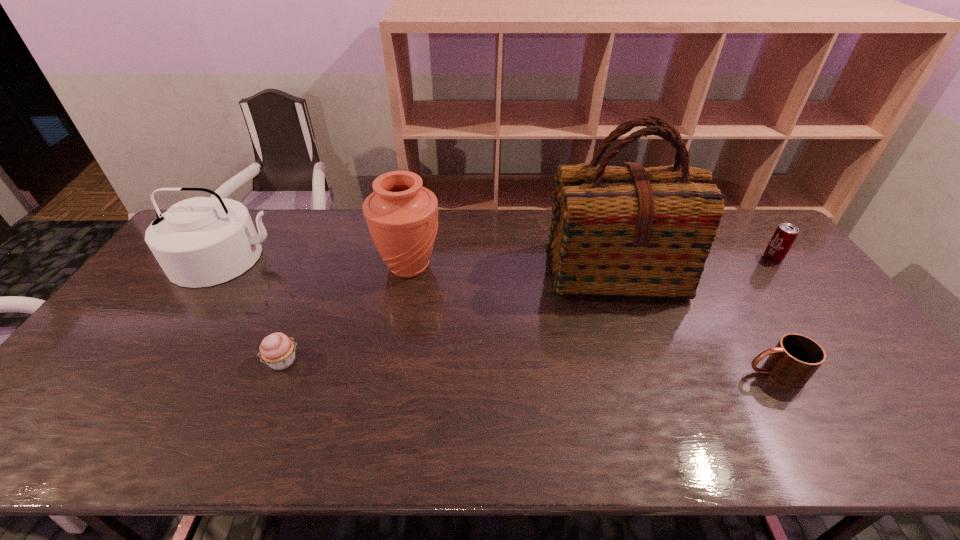
Image resolution: width=960 pixels, height=540 pixels. In order to click on object that is at the left edge in this screenshot , I will do `click(199, 242)`.

You are a GUI agent. You are given a task and a screenshot of the screen. Output one action in this format:
    pyautogui.click(x=<x>, y=<y>)
    Task: Click on the object at the right edge
    This screenshot has width=960, height=540.
    Given the screenshot: What is the action you would take?
    pyautogui.click(x=785, y=234)

Where is `object that is at the far left corner`? This screenshot has height=540, width=960. object that is at the far left corner is located at coordinates (199, 242).

Image resolution: width=960 pixels, height=540 pixels. In order to click on free location at the far edge of the desktop in this screenshot , I will do `click(456, 236)`.

The width and height of the screenshot is (960, 540). I want to click on free space at the left edge of the desktop, so click(x=117, y=329).

This screenshot has width=960, height=540. I want to click on free space at the right edge of the desktop, so click(813, 313).

I want to click on free space between the second object from left to right and the rightmost object, so click(x=528, y=309).

Image resolution: width=960 pixels, height=540 pixels. I want to click on free space between the fourth shortest object and the fourth object from right to left, so click(318, 262).

Identify the location of vacant space that's between the fourth tallest object and the fifth object from right to left. (528, 309).

I want to click on free space between the cupcake and the third object from right to left, so click(448, 316).